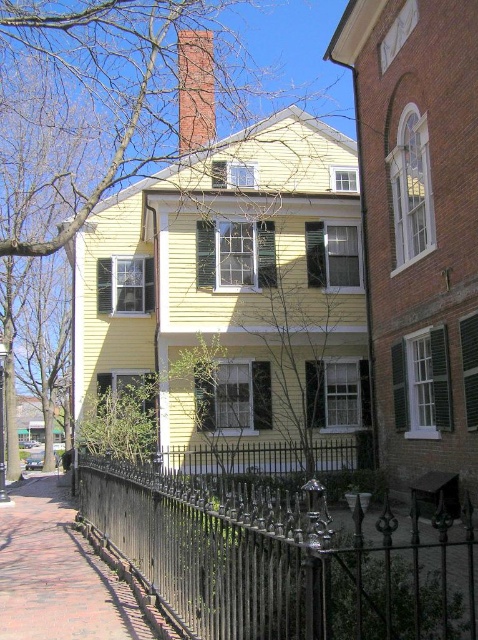
Question: Observing the image, what is the correct spatial positioning of brick pavement at lower left in reference to brick chimney at upper center?

Choices:
 (A) left
 (B) right

Answer: (A)

Question: Estimate the real-world distances between objects in this image. Which object is farther from the green leafy tree at upper left?

Choices:
 (A) brick chimney at upper center
 (B) dark brown wrought iron fence at lower left

Answer: (B)

Question: Is the position of dark brown wrought iron fence at lower left less distant than that of brick chimney at upper center?

Choices:
 (A) yes
 (B) no

Answer: (A)

Question: Which of the following is the farthest from the observer?

Choices:
 (A) green leafy tree at upper left
 (B) brick pavement at lower left

Answer: (A)

Question: Is dark brown wrought iron fence at lower left positioned behind green leafy tree at upper left?

Choices:
 (A) yes
 (B) no

Answer: (B)

Question: Which point is farther from the camera taking this photo?

Choices:
 (A) (279, 3)
 (B) (148, 490)
 (C) (183, 134)
 (D) (50, 582)

Answer: (A)